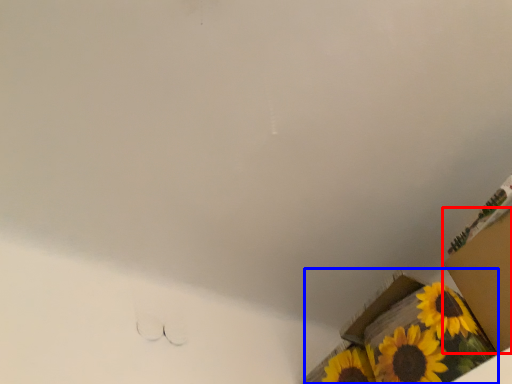
Question: Which object appears closest to the camera in this image, cardboard box (highlighted by a red box) or cardboard box (highlighted by a blue box)?

Choices:
 (A) cardboard box
 (B) cardboard box

Answer: (A)